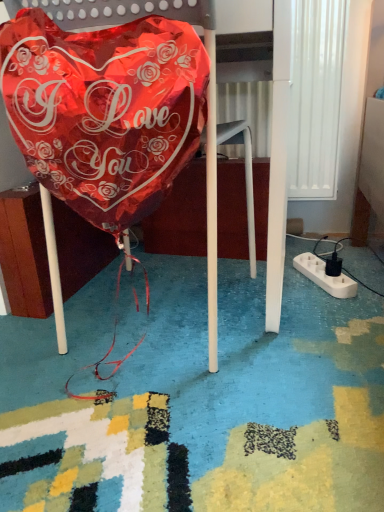
This screenshot has width=384, height=512. What are the coordinates of `vacant area that is in front of white plastic extension cord at lower right` in the screenshot? It's located at (332, 311).